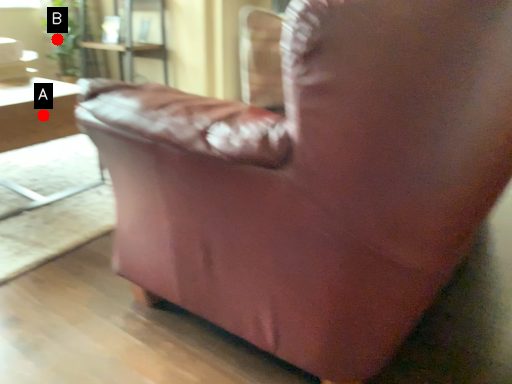
Question: Two points are circled on the image, labeled by A and B beside each circle. Which point appears farthest from the camera in this image?

Choices:
 (A) A is further
 (B) B is further

Answer: (B)